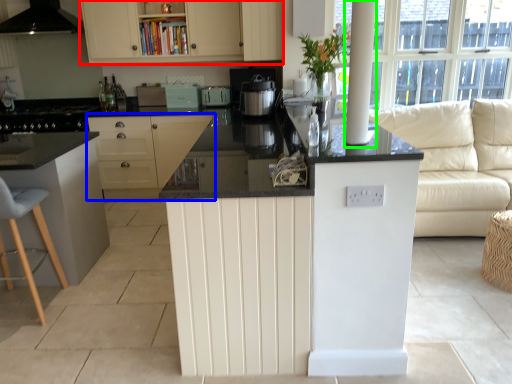
Question: Estimate the real-world distances between objects in this image. Which object is closer to cabinetry (highlighted by a red box), cabinetry (highlighted by a blue box) or pillar (highlighted by a green box)?

Choices:
 (A) cabinetry
 (B) pillar

Answer: (A)